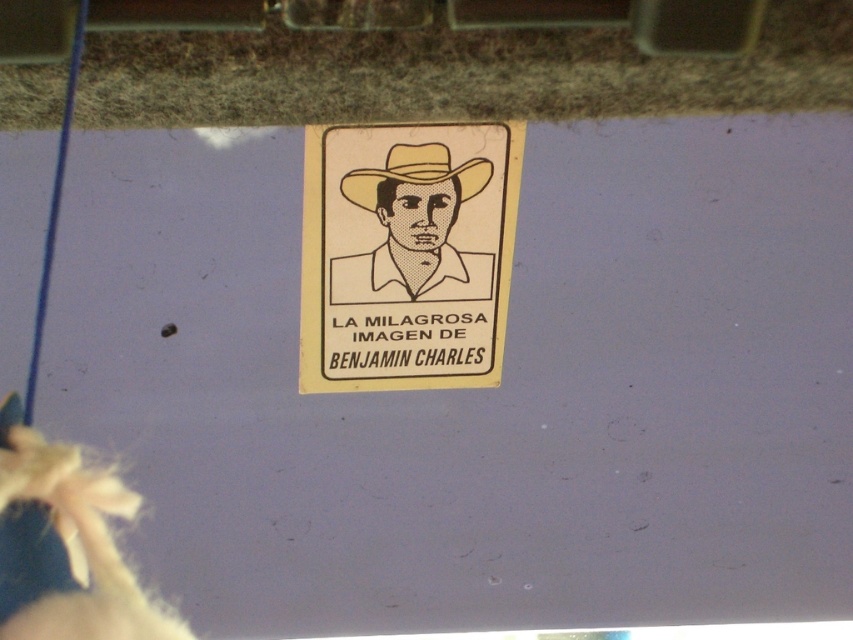
Question: Which point is farther from the camera taking this photo?

Choices:
 (A) (412, 298)
 (B) (496, 148)
 (C) (358, 193)

Answer: (A)

Question: Can you confirm if white paper sign at center is bigger than beige paper sticker at center?

Choices:
 (A) no
 (B) yes

Answer: (B)

Question: Which point is farther to the camera?

Choices:
 (A) (369, 170)
 (B) (476, 304)

Answer: (B)

Question: Which is nearer to the beige paper sticker at center?

Choices:
 (A) white paper sign at center
 (B) beige paper cowboy hat at center

Answer: (A)

Question: Observing the image, what is the correct spatial positioning of white paper sign at center in reference to beige paper sticker at center?

Choices:
 (A) right
 (B) left

Answer: (B)

Question: Can you confirm if white paper sign at center is bigger than beige paper cowboy hat at center?

Choices:
 (A) yes
 (B) no

Answer: (A)